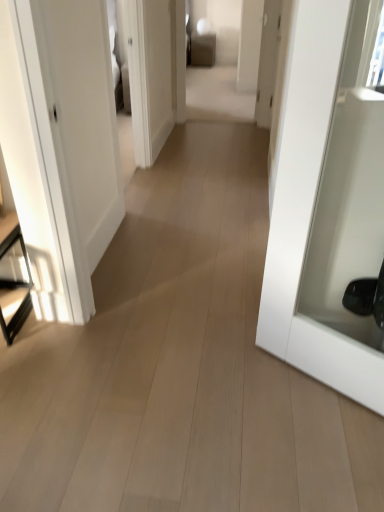
Find the location of a particular element. vacant region in front of white glossy door at right is located at coordinates (309, 440).